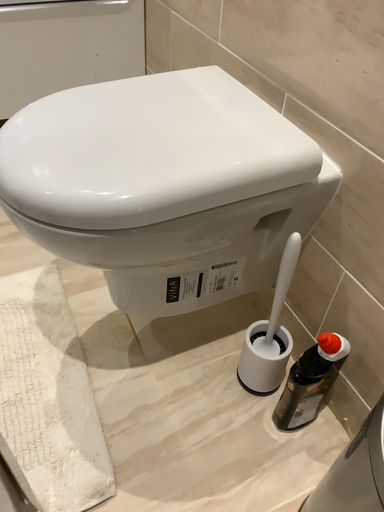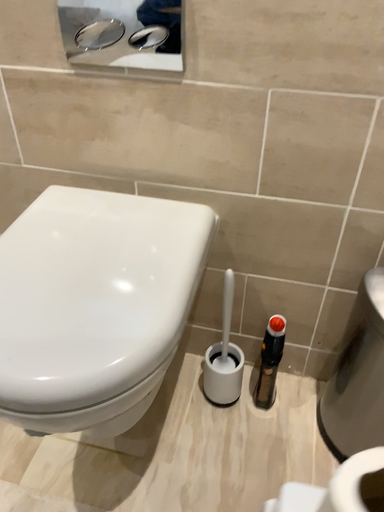
Question: How did the camera likely rotate when shooting the video?

Choices:
 (A) rotated upward
 (B) rotated downward

Answer: (A)